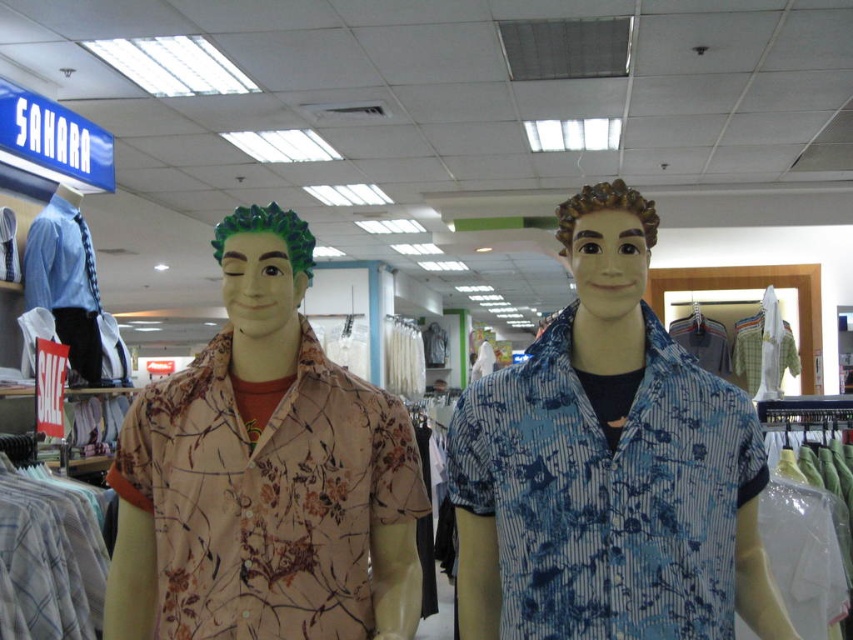
Question: Which point is farther from the camera taking this photo?

Choices:
 (A) (228, 467)
 (B) (480, 435)

Answer: (B)

Question: Which point is farther to the camera?

Choices:
 (A) (639, 490)
 (B) (344, 636)

Answer: (B)

Question: Is blue striped shirt at center to the left of matte floral shirt at center from the viewer's perspective?

Choices:
 (A) yes
 (B) no

Answer: (B)

Question: Does blue striped shirt at center appear on the right side of matte floral shirt at center?

Choices:
 (A) yes
 (B) no

Answer: (A)

Question: Is blue striped shirt at center closer to the viewer compared to matte floral shirt at center?

Choices:
 (A) no
 (B) yes

Answer: (B)

Question: Which object is farther from the camera taking this photo?

Choices:
 (A) matte floral shirt at center
 (B) blue striped shirt at center

Answer: (A)